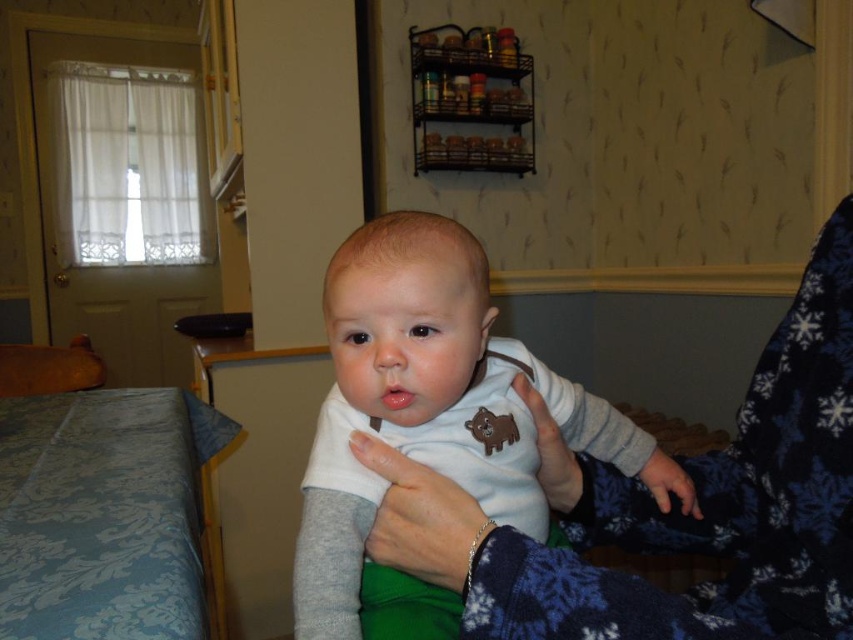
You are a photographer trying to capture a closeup of the baby in the scene. You need to adjust your focus so that both the white soft onesie at center and the white fabric at center are clearly visible. Which object should you focus on first to ensure the other is also in focus?

The white soft onesie at center is positioned on the right side of white fabric at center. Since they are both at the same distance from the camera, focusing on either one will keep both in focus.

You are a home decorator planning to place a decorative pillow between the blue damask fabric bed at lower left and the soft blue fabric hand at lower right. According to the scene, which object should the pillow be closer to?

The blue damask fabric bed at lower left is located below the soft blue fabric hand at lower right, so the decorative pillow should be placed closer to the blue damask fabric bed at lower left to maintain balance in the arrangement.

From the picture: You are a photographer trying to capture a candid shot of the baby in the white soft onesie at center. The baby is currently at point (422, 419). To ensure the best lighting, you need to position yourself directly in front of the baby. Where should you stand relative to the baby?

Since the white soft onesie at center is located at point (422, 419), you should stand directly in front of this coordinate to ensure the best lighting for the candid shot.